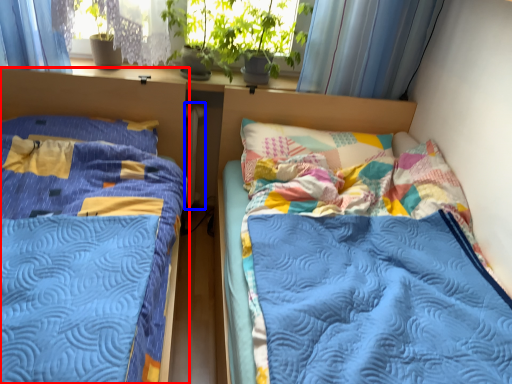
Question: Which of the following is the closest to the observer, bed (highlighted by a red box) or radiator (highlighted by a blue box)?

Choices:
 (A) bed
 (B) radiator

Answer: (A)